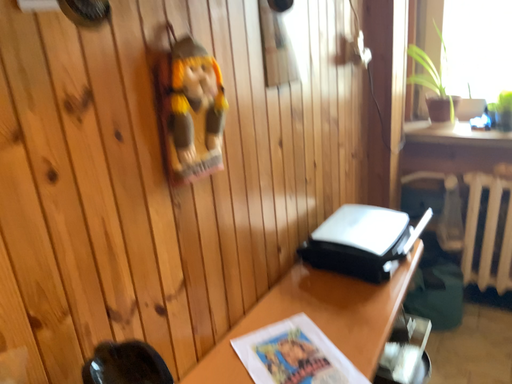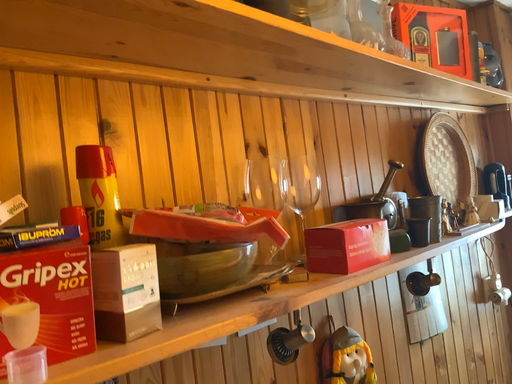
Question: Which way did the camera rotate in the video?

Choices:
 (A) rotated right
 (B) rotated left

Answer: (B)